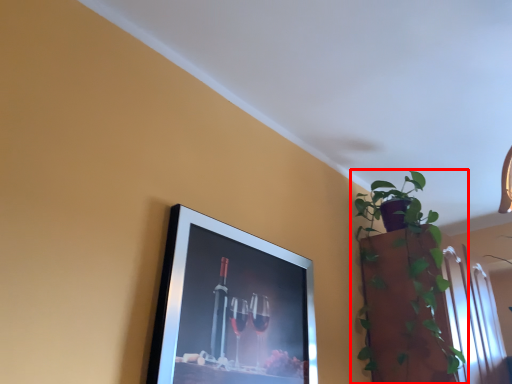
Question: From the image's perspective, where is houseplant (annotated by the red box) located in relation to picture frame in the image?

Choices:
 (A) above
 (B) below

Answer: (A)